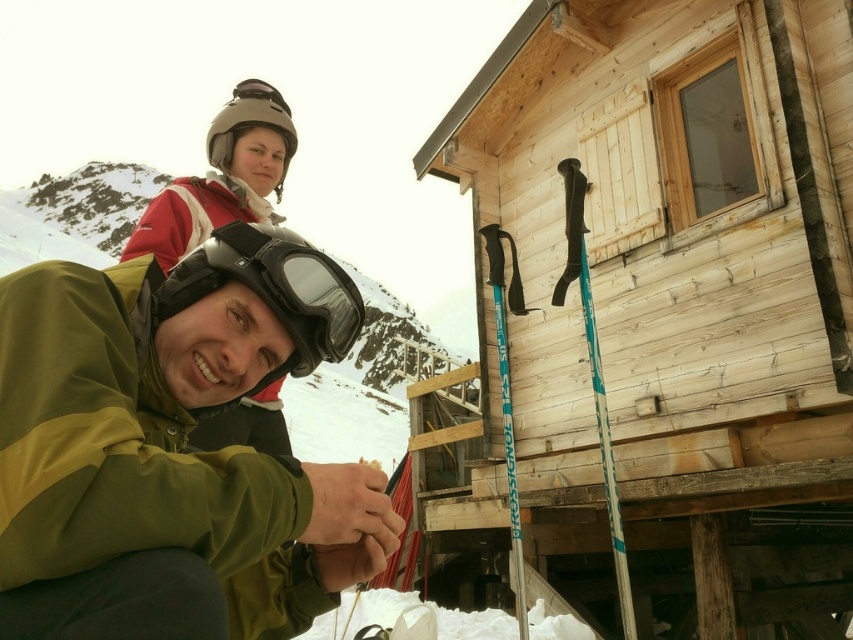
Question: Which is nearer to the weathered wood cabin at center?

Choices:
 (A) matte gray helmet at upper center
 (B) black matte goggles at center
 (C) green matte jacket at lower left

Answer: (C)

Question: Is weathered wood cabin at center below matte gray helmet at upper center?

Choices:
 (A) no
 (B) yes

Answer: (B)

Question: Which object appears farthest from the camera in this image?

Choices:
 (A) black matte goggles at center
 (B) weathered wood cabin at center

Answer: (B)

Question: Is weathered wood cabin at center to the right of matte gray helmet at upper center from the viewer's perspective?

Choices:
 (A) no
 (B) yes

Answer: (B)

Question: Does weathered wood cabin at center come in front of green matte jacket at lower left?

Choices:
 (A) no
 (B) yes

Answer: (A)

Question: Which object is positioned closest to the black matte goggles at center?

Choices:
 (A) matte gray helmet at upper center
 (B) weathered wood cabin at center
 (C) green matte jacket at lower left

Answer: (C)